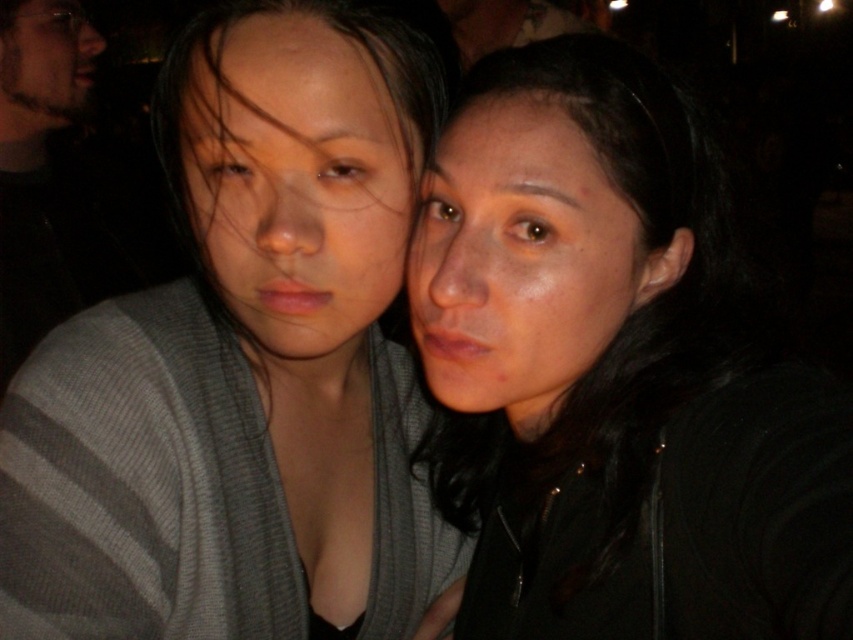
Is point (186, 173) farther from camera compared to point (660, 236)?

That is False.

You are a GUI agent. You are given a task and a screenshot of the screen. Output one action in this format:
    pyautogui.click(x=<x>, y=<y>)
    Task: Click on the gray knitted sweater at center
    Image resolution: width=853 pixels, height=640 pixels.
    Given the screenshot: What is the action you would take?
    pyautogui.click(x=244, y=364)

You are a GUI agent. You are given a task and a screenshot of the screen. Output one action in this format:
    pyautogui.click(x=<x>, y=<y>)
    Task: Click on the gray knitted sweater at center
    
    Given the screenshot: What is the action you would take?
    pyautogui.click(x=244, y=364)

Between matte gray sweater at left and beige textured beard at upper left, which one is positioned higher?

beige textured beard at upper left is above.

Can you confirm if matte gray sweater at left is positioned to the left of beige textured beard at upper left?

Incorrect, matte gray sweater at left is not on the left side of beige textured beard at upper left.

This screenshot has width=853, height=640. What do you see at coordinates (297, 180) in the screenshot? I see `matte gray sweater at left` at bounding box center [297, 180].

This screenshot has height=640, width=853. In order to click on matte gray sweater at left in this screenshot , I will do `click(297, 180)`.

Between point (480, 336) and point (229, 84), which one is positioned in front?

Point (229, 84) is more forward.

You are a GUI agent. You are given a task and a screenshot of the screen. Output one action in this format:
    pyautogui.click(x=<x>, y=<y>)
    Task: Click on the matte black hair at center
    The height and width of the screenshot is (640, 853).
    Given the screenshot: What is the action you would take?
    pyautogui.click(x=614, y=372)